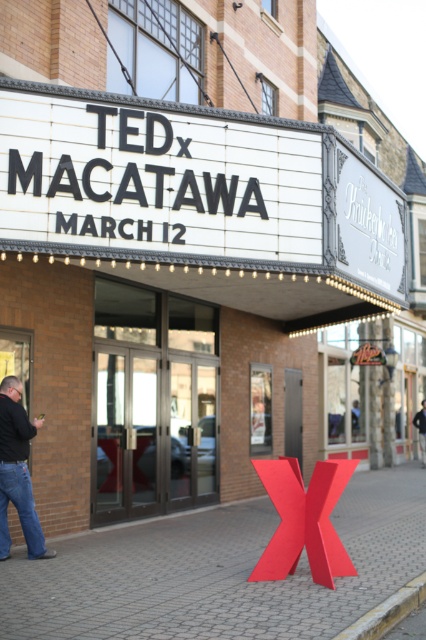
Question: Which object is the farthest from the dark blue jeans at center?

Choices:
 (A) dark blue jeans at lower left
 (B) matte red x at center

Answer: (A)

Question: Which of the following is the farthest from the observer?

Choices:
 (A) matte red x at center
 (B) dark blue jeans at center

Answer: (B)

Question: Considering the real-world distances, which object is farthest from the dark blue jeans at lower left?

Choices:
 (A) matte red x at center
 (B) dark blue jeans at center

Answer: (B)

Question: Can you confirm if matte red x at center is wider than dark blue jeans at lower left?

Choices:
 (A) yes
 (B) no

Answer: (A)

Question: Does matte red x at center have a smaller size compared to dark blue jeans at lower left?

Choices:
 (A) yes
 (B) no

Answer: (B)

Question: Can you confirm if matte red x at center is positioned to the right of dark blue jeans at center?

Choices:
 (A) no
 (B) yes

Answer: (A)